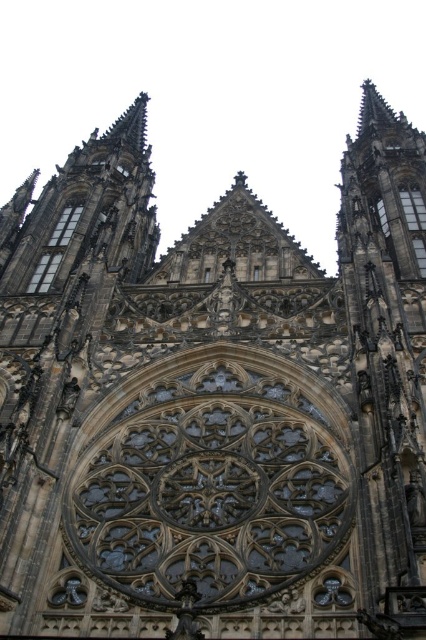
Question: Among these points, which one is nearest to the camera?

Choices:
 (A) (409, 209)
 (B) (48, 260)

Answer: (B)

Question: Can you confirm if clear glass window at left is smaller than transparent glass window at upper right?

Choices:
 (A) yes
 (B) no

Answer: (B)

Question: Among these points, which one is farthest from the camera?

Choices:
 (A) (43, 252)
 (B) (408, 189)

Answer: (B)

Question: Is clear glass window at left further to camera compared to transparent glass window at upper right?

Choices:
 (A) yes
 (B) no

Answer: (B)

Question: Does clear glass window at left have a lesser width compared to transparent glass window at upper right?

Choices:
 (A) no
 (B) yes

Answer: (B)